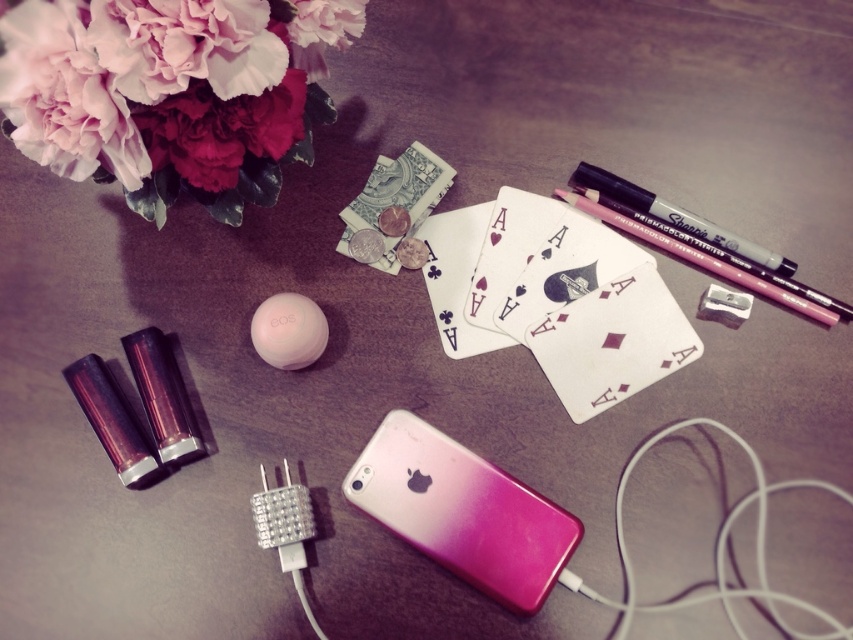
How far apart are pink gradient plastic ipod at center and pink matte pencil at upper right?

The distance of pink gradient plastic ipod at center from pink matte pencil at upper right is 11.02 inches.

Describe the element at coordinates (462, 512) in the screenshot. The image size is (853, 640). I see `pink gradient plastic ipod at center` at that location.

I want to click on pink gradient plastic ipod at center, so click(462, 512).

Can you confirm if pink matte flower at upper left is positioned to the right of matte black marker at upper right?

No, pink matte flower at upper left is not to the right of matte black marker at upper right.

Which is more to the left, pink matte flower at upper left or matte black marker at upper right?

From the viewer's perspective, pink matte flower at upper left appears more on the left side.

This screenshot has height=640, width=853. In order to click on pink matte flower at upper left in this screenshot , I will do `click(171, 92)`.

Between point (138, 20) and point (503, 566), which one is positioned behind?

The point (503, 566) is behind.

Image resolution: width=853 pixels, height=640 pixels. Find the location of `pink matte flower at upper left`. pink matte flower at upper left is located at coordinates (171, 92).